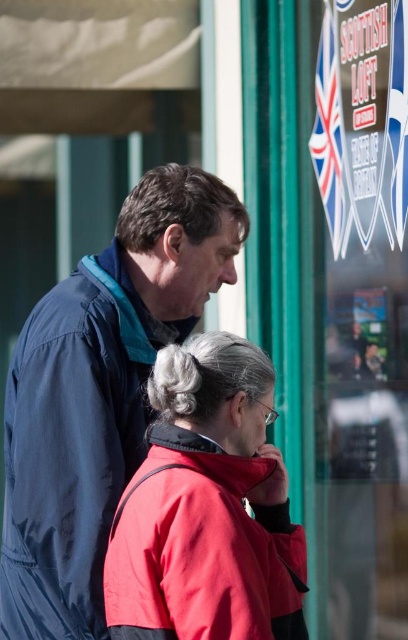
Question: Which point is closer to the camera?

Choices:
 (A) (108, 634)
 (B) (170, 408)

Answer: (B)

Question: In this image, where is matte blue jacket at center located relative to red matte jacket at lower center?

Choices:
 (A) right
 (B) left

Answer: (B)

Question: Among these objects, which one is nearest to the camera?

Choices:
 (A) matte blue jacket at center
 (B) red matte jacket at lower center

Answer: (B)

Question: Can you confirm if matte blue jacket at center is wider than red matte jacket at lower center?

Choices:
 (A) yes
 (B) no

Answer: (A)

Question: Is matte blue jacket at center positioned in front of red matte jacket at lower center?

Choices:
 (A) no
 (B) yes

Answer: (A)